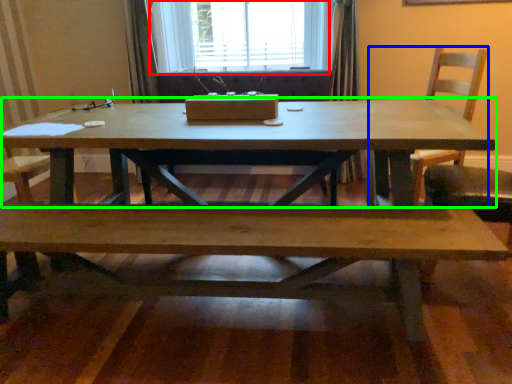
Question: Based on their relative distances, which object is nearer to window (highlighted by a red box)? Choose from chair (highlighted by a blue box) and coffee table (highlighted by a green box).

Choices:
 (A) chair
 (B) coffee table

Answer: (A)